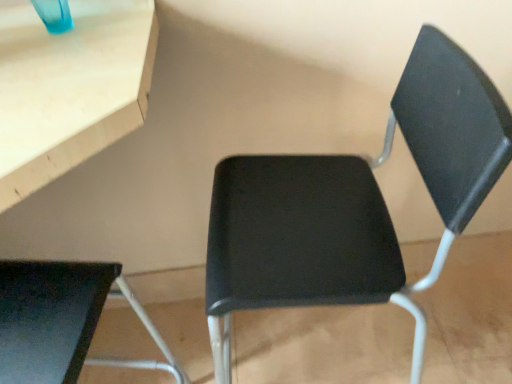
Question: Should I look upward or downward to see black matte chair at center?

Choices:
 (A) up
 (B) down

Answer: (B)